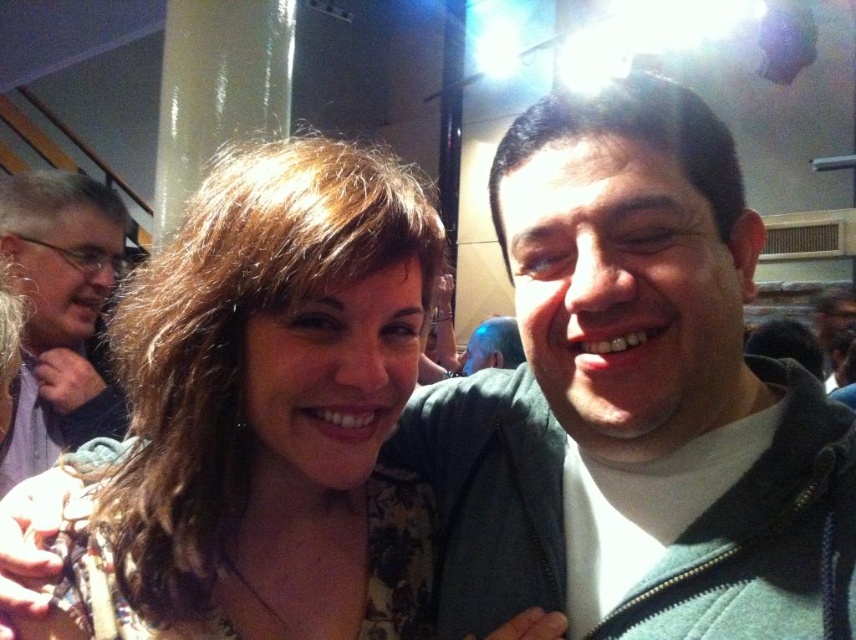
You are at a social event and see two people dressed in the matte floral dress at center and the gray fabric shirt at left. Which clothing item is positioned lower in the image?

The matte floral dress at center is positioned lower than the gray fabric shirt at left in the image.

You are a photographer trying to capture a group photo of the gray fabric shirt at left and the blue metallic head at center. If your camera can only focus on objects within 5 feet, will both subjects be in focus?

The distance between the gray fabric shirt at left and the blue metallic head at center is 5.41 feet. Since the camera can only focus within 5 feet, the subjects are slightly out of range, so they might not both be in focus.